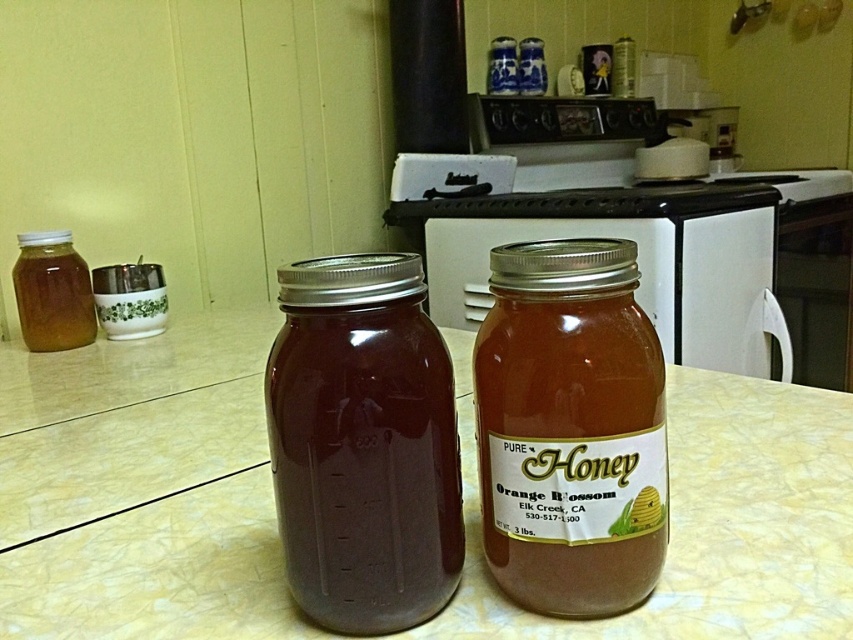
You are a delivery person holding a package that requires precise placement on the countertop. The package must be placed exactly 12 inches away from the golden honey jar at center to avoid blocking its label. Can you place the package without moving the jar?

The golden honey jar at center is currently 13.43 inches away from the viewer. Since the required distance is 12 inches, the package can be placed closer to the jar by 1.43 inches to meet the 12 inch requirement without moving the jar.

You have a small cookie jar that needs to be placed on the countertop next to the translucent glass jar at center and the golden honey jar at center. Which of the two jars should you place the cookie jar next to if you want it to be closer to the wider jar?

The translucent glass jar at center is wider than the golden honey jar at center, so you should place the cookie jar next to the translucent glass jar at center to be closer to the wider jar.

You are a chef preparing a recipe that requires precise measurements. You have two jars of honey in front of you on the counter. The golden honey jar at center and the translucent amber honey jar at left. Which jar is shorter?

The golden honey jar at center has a lesser height compared to the translucent amber honey jar at left, so the golden honey jar at center is shorter.